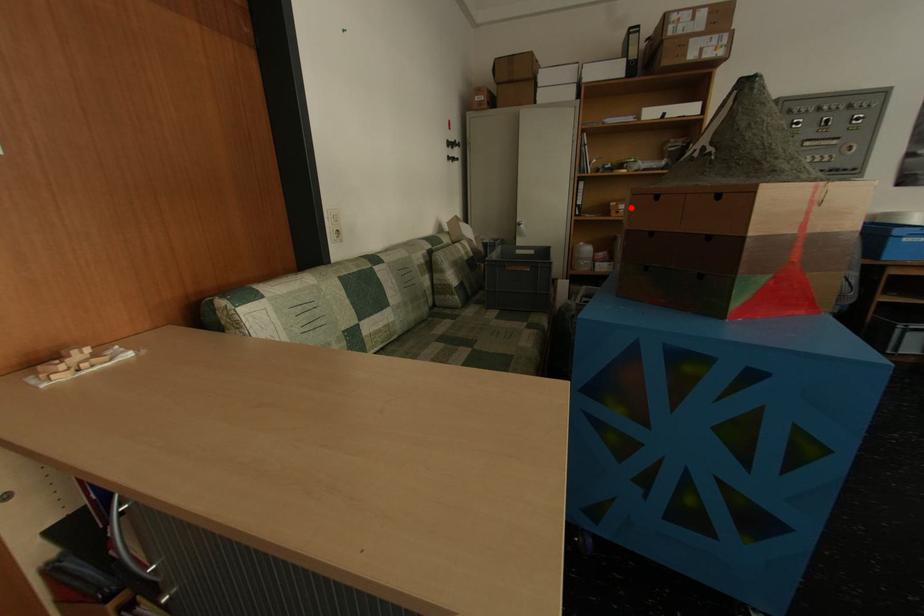
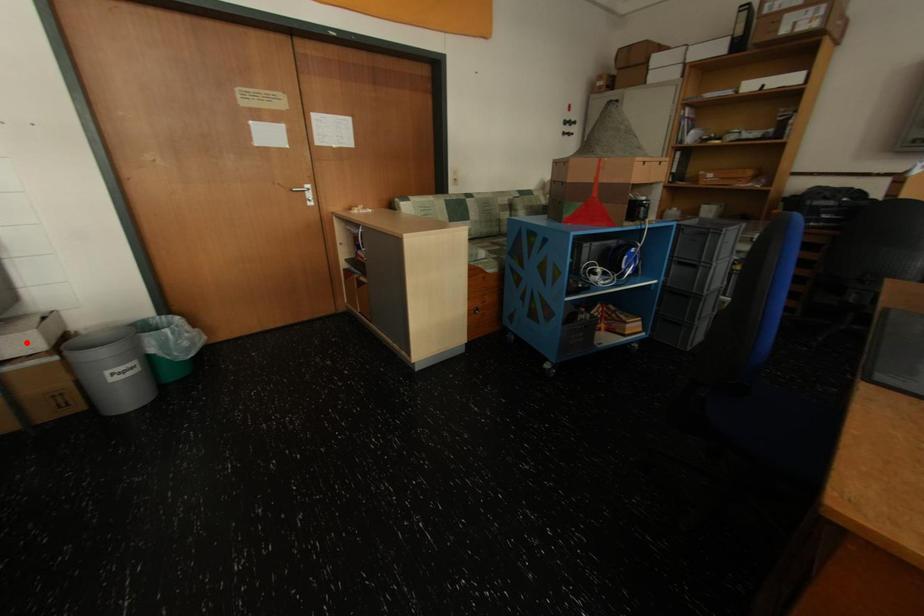
I am providing you with two images of the same scene from different viewpoints. A red point is marked on the first image and another point is marked on the second image. Are the points marked in image1 and image2 representing the same 3D position?

No